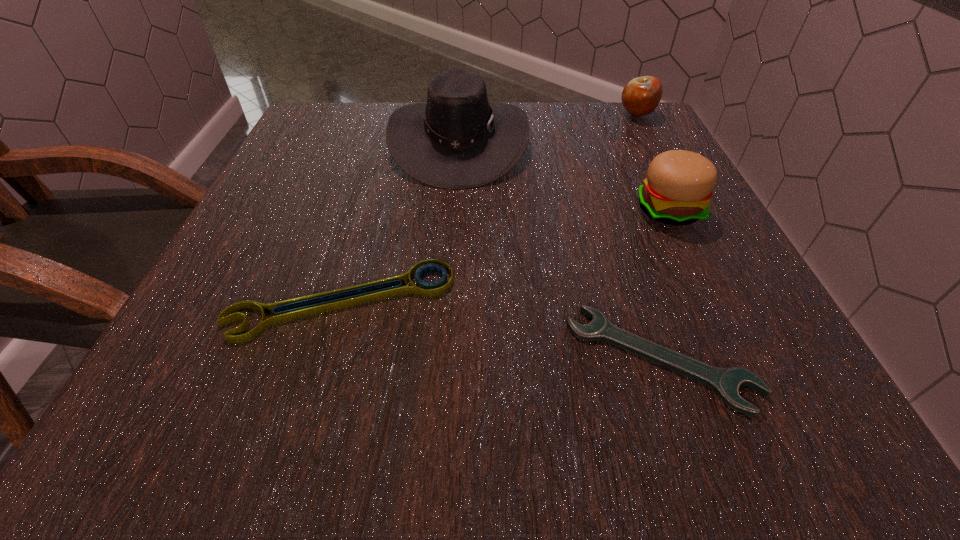
Identify the location of the tallest object. The image size is (960, 540). (457, 140).

Locate an element on the screen. the fourth shortest object is located at coordinates (677, 191).

Where is `hamburger`? This screenshot has height=540, width=960. hamburger is located at coordinates (677, 191).

At what (x,y) coordinates should I click in order to perform the action: click on apple. Please return your answer as a coordinate pair (x, y). Looking at the image, I should click on (641, 96).

You are a GUI agent. You are given a task and a screenshot of the screen. Output one action in this format:
    pyautogui.click(x=<x>, y=<y>)
    Task: Click on the left wrench
    The width and height of the screenshot is (960, 540).
    Given the screenshot: What is the action you would take?
    pyautogui.click(x=287, y=310)

This screenshot has height=540, width=960. Identify the location of the right wrench. (725, 382).

Where is `vacant space located 0.140m on the front-facing side of the tallest object`? The image size is (960, 540). vacant space located 0.140m on the front-facing side of the tallest object is located at coordinates click(592, 142).

The width and height of the screenshot is (960, 540). In order to click on free space located on the front of the third farthest object in this screenshot , I will do `click(699, 274)`.

The height and width of the screenshot is (540, 960). I want to click on vacant space situated on the front of the third tallest object, so click(x=702, y=235).

This screenshot has width=960, height=540. Identify the location of vacant space located 0.370m on the right of the left wrench. (708, 301).